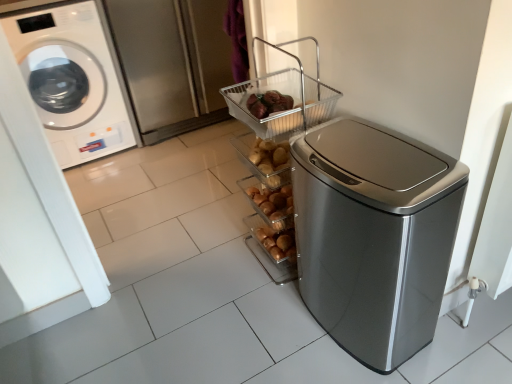
Measure the distance between point [250,84] and camera.

Point [250,84] is 1.47 meters from camera.

Identify the location of white glossy washing machine at left. The height and width of the screenshot is (384, 512). (73, 81).

What do you see at coordinates (154, 66) in the screenshot? The height and width of the screenshot is (384, 512). I see `brushed metal screen door at upper left` at bounding box center [154, 66].

Image resolution: width=512 pixels, height=384 pixels. In order to click on brushed metal screen door at upper left in this screenshot , I will do `click(154, 66)`.

Identify the location of metallic wire basket at upper center. (284, 110).

Can you confirm if satin silver trash can at right is thinner than brushed metal screen door at upper left?

Yes, satin silver trash can at right is thinner than brushed metal screen door at upper left.

From a real-world perspective, is satin silver trash can at right positioned above or below brushed metal screen door at upper left?

From a real-world perspective, satin silver trash can at right is physically below brushed metal screen door at upper left.

From the image's perspective, is satin silver trash can at right located above or below brushed metal screen door at upper left?

From the image's perspective, satin silver trash can at right appears below brushed metal screen door at upper left.

Which of these two, brushed metal screen door at upper left or satin silver trash can at right, stands taller?

brushed metal screen door at upper left is taller.

Is brushed metal screen door at upper left looking in the opposite direction of satin silver trash can at right?

No, brushed metal screen door at upper left's orientation is not away from satin silver trash can at right.

Is point (144, 80) closer or farther from the camera than point (410, 290)?

Point (144, 80) appears to be farther away from the viewer than point (410, 290).

From the picture: From a real-world perspective, is metallic wire basket at upper center physically above brushed metal screen door at upper left?

Correct, in the physical world, metallic wire basket at upper center is higher than brushed metal screen door at upper left.

From the picture: Is metallic wire basket at upper center far from brushed metal screen door at upper left?

That's right, there is a large distance between metallic wire basket at upper center and brushed metal screen door at upper left.

Is metallic wire basket at upper center facing away from brushed metal screen door at upper left?

No.

Can you confirm if metallic wire basket at upper center is taller than brushed metal screen door at upper left?

No.

Considering the positions of points (157, 137) and (60, 140), is point (157, 137) farther from camera compared to point (60, 140)?

Yes, it is.

Is brushed metal screen door at upper left not within white glossy washing machine at left?

Indeed, brushed metal screen door at upper left is completely outside white glossy washing machine at left.

The height and width of the screenshot is (384, 512). I want to click on washing machine above the brushed metal screen door at upper left (from a real-world perspective), so click(x=73, y=81).

Which of these two, brushed metal screen door at upper left or white glossy washing machine at left, is bigger?

brushed metal screen door at upper left is bigger.

Does point (374, 198) come closer to viewer compared to point (87, 80)?

That is True.

Consider the image. Is satin silver trash can at right shorter than white glossy washing machine at left?

Yes.

Considering the sizes of satin silver trash can at right and metallic wire basket at upper center in the image, is satin silver trash can at right taller or shorter than metallic wire basket at upper center?

Considering their sizes, satin silver trash can at right has more height than metallic wire basket at upper center.

How distant is satin silver trash can at right from metallic wire basket at upper center?

satin silver trash can at right and metallic wire basket at upper center are 14.87 inches apart.

Would you say satin silver trash can at right is outside metallic wire basket at upper center?

satin silver trash can at right is positioned outside metallic wire basket at upper center.

Considering the sizes of objects satin silver trash can at right and metallic wire basket at upper center in the image provided, who is bigger, satin silver trash can at right or metallic wire basket at upper center?

Bigger between the two is satin silver trash can at right.

Relative to satin silver trash can at right, is metallic wire basket at upper center in front or behind?

Visually, metallic wire basket at upper center is located behind satin silver trash can at right.

From a real-world perspective, which object rests below the other?

In real-world perspective, satin silver trash can at right is lower.

From the image's perspective, which one is positioned lower, metallic wire basket at upper center or satin silver trash can at right?

satin silver trash can at right is shown below in the image.

Is metallic wire basket at upper center directly adjacent to satin silver trash can at right?

No, metallic wire basket at upper center is not beside satin silver trash can at right.

Locate an element on the screen. The width and height of the screenshot is (512, 384). screen door that appears behind the satin silver trash can at right is located at coordinates (154, 66).

You are a GUI agent. You are given a task and a screenshot of the screen. Output one action in this format:
    pyautogui.click(x=<x>, y=<y>)
    Task: Click on the screen door above the satin silver trash can at right (from the image's perspective)
    Image resolution: width=512 pixels, height=384 pixels.
    Given the screenshot: What is the action you would take?
    pyautogui.click(x=154, y=66)

Estimate the real-world distances between objects in this image. Which object is further from white glossy washing machine at left, brushed metal screen door at upper left or metallic wire basket at upper center?

The object further to white glossy washing machine at left is metallic wire basket at upper center.

From the image, which object appears to be nearer to brushed metal screen door at upper left, metallic wire basket at upper center or white glossy washing machine at left?

white glossy washing machine at left.

Based on the photo, estimate the real-world distances between objects in this image. Which object is further from metallic wire basket at upper center, brushed metal screen door at upper left or white glossy washing machine at left?

Based on the image, white glossy washing machine at left appears to be further to metallic wire basket at upper center.

Considering their positions, is metallic wire basket at upper center positioned closer to satin silver trash can at right than brushed metal screen door at upper left?

metallic wire basket at upper center is closer to satin silver trash can at right.

Considering their positions, is white glossy washing machine at left positioned further to brushed metal screen door at upper left than metallic wire basket at upper center?

Among the two, metallic wire basket at upper center is located further to brushed metal screen door at upper left.

Based on the photo, estimate the real-world distances between objects in this image. Which object is further from white glossy washing machine at left, satin silver trash can at right or brushed metal screen door at upper left?

Based on the image, satin silver trash can at right appears to be further to white glossy washing machine at left.

Based on their spatial positions, is white glossy washing machine at left or brushed metal screen door at upper left closer to metallic wire basket at upper center?

The object closer to metallic wire basket at upper center is brushed metal screen door at upper left.

Based on their spatial positions, is brushed metal screen door at upper left or white glossy washing machine at left further from satin silver trash can at right?

Based on the image, white glossy washing machine at left appears to be further to satin silver trash can at right.

The height and width of the screenshot is (384, 512). Find the location of `screen door located between white glossy washing machine at left and metallic wire basket at upper center in the left-right direction`. screen door located between white glossy washing machine at left and metallic wire basket at upper center in the left-right direction is located at coordinates (154, 66).

You are a GUI agent. You are given a task and a screenshot of the screen. Output one action in this format:
    pyautogui.click(x=<x>, y=<y>)
    Task: Click on the basket between satin silver trash can at right and brushed metal screen door at upper left along the z-axis
    This screenshot has width=512, height=384.
    Given the screenshot: What is the action you would take?
    pyautogui.click(x=284, y=110)

Identify the location of screen door located between white glossy washing machine at left and satin silver trash can at right in the left-right direction. (154, 66).

The image size is (512, 384). I want to click on basket between white glossy washing machine at left and satin silver trash can at right in the horizontal direction, so click(284, 110).